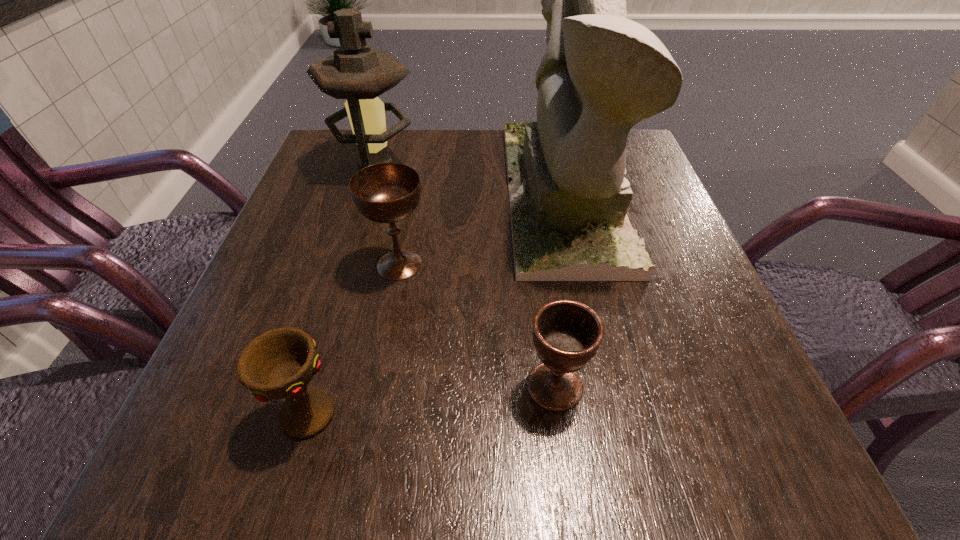
At what (x,y) coordinates should I click in order to perform the action: click on vacant area between the tallest object and the fourth shortest object. Please return your answer as a coordinate pair (x, y). The height and width of the screenshot is (540, 960). Looking at the image, I should click on (469, 181).

The image size is (960, 540). Identify the location of vacant region between the sculpture and the rightmost chalice. (559, 290).

Where is `object that stands as the closest to the fourth shortest object`? This screenshot has width=960, height=540. object that stands as the closest to the fourth shortest object is located at coordinates (386, 192).

The width and height of the screenshot is (960, 540). I want to click on the fourth closest object to the sculpture, so click(280, 363).

Locate which chalice is the second closest to the tallest object. Please provide its 2D coordinates. Your answer should be formatted as a tuple, i.e. [(x, y)], where the tuple contains the x and y coordinates of a point satisfying the conditions above.

[(567, 334)]

Locate an element on the screen. chalice identified as the closest to the farthest chalice is located at coordinates (280, 363).